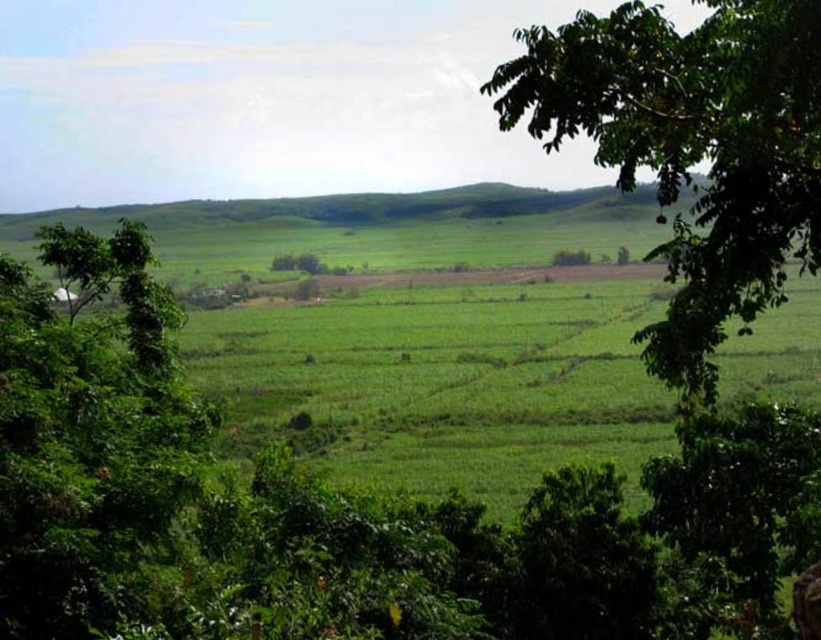
Based on the photo, can you confirm if green grassy field at center is positioned below green leafy tree at center?

Yes.

Which is behind, point (287, 406) or point (551, 97)?

Positioned behind is point (287, 406).

Where is `green grassy field at center`? This screenshot has width=821, height=640. green grassy field at center is located at coordinates (441, 384).

Can you confirm if green grassy field at center is bigger than green leafy tree at left?

Yes, green grassy field at center is bigger than green leafy tree at left.

Is green grassy field at center to the left of green leafy tree at left from the viewer's perspective?

Incorrect, green grassy field at center is not on the left side of green leafy tree at left.

What do you see at coordinates (441, 384) in the screenshot? I see `green grassy field at center` at bounding box center [441, 384].

The width and height of the screenshot is (821, 640). Find the location of `green grassy field at center`. green grassy field at center is located at coordinates (441, 384).

Consider the image. Between green leafy tree at center and green leafy tree at left, which one appears on the right side from the viewer's perspective?

green leafy tree at center

Can you confirm if green leafy tree at center is thinner than green leafy tree at left?

A: Yes.

Is point (658, 22) closer to camera compared to point (23, 454)?

Yes, point (658, 22) is closer to viewer.

Identify the location of green leafy tree at center. (691, 148).